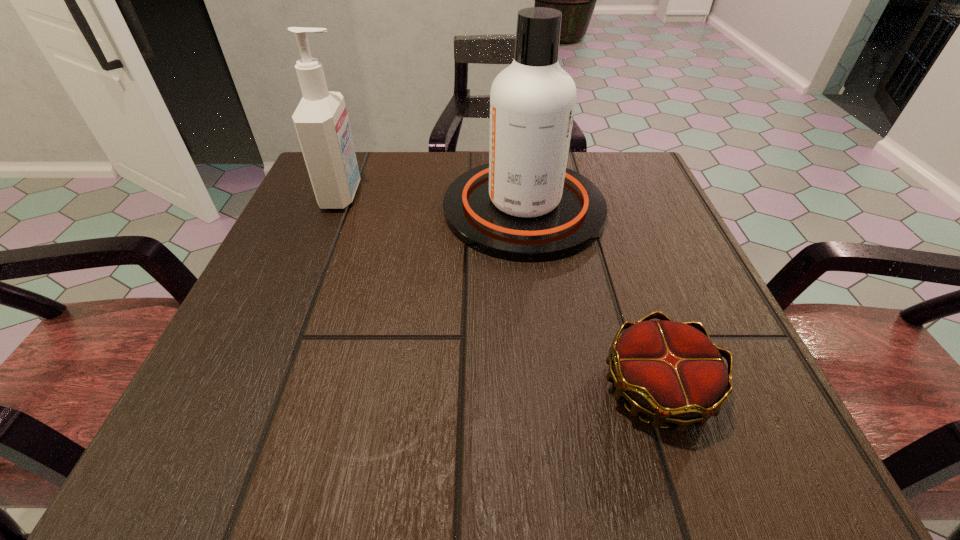
Locate which object is the second closest to the leftmost object. Please provide its 2D coordinates. Your answer should be formatted as a tuple, i.e. [(x, y)], where the tuple contains the x and y coordinates of a point satisfying the conditions above.

[(671, 371)]

I want to click on free space that satisfies the following two spatial constraints: 1. on the front label of the left cleansing agent; 2. on the back side of the right cleansing agent, so click(337, 209).

Identify the location of free spot that satisfies the following two spatial constraints: 1. on the front label of the left cleansing agent; 2. on the right side of the nearest object. The height and width of the screenshot is (540, 960). (265, 389).

Locate an element on the screen. The height and width of the screenshot is (540, 960). free region that satisfies the following two spatial constraints: 1. on the front label of the nearest object; 2. on the left side of the left cleansing agent is located at coordinates (265, 389).

You are a GUI agent. You are given a task and a screenshot of the screen. Output one action in this format:
    pyautogui.click(x=<x>, y=<y>)
    Task: Click on the free location that satisfies the following two spatial constraints: 1. on the front label of the leftmost object; 2. on the back side of the shortest object
    Image resolution: width=960 pixels, height=540 pixels.
    Given the screenshot: What is the action you would take?
    pyautogui.click(x=265, y=389)

Where is `free spot that satisfies the following two spatial constraints: 1. on the front label of the left cleansing agent; 2. on the left side of the right cleansing agent`? free spot that satisfies the following two spatial constraints: 1. on the front label of the left cleansing agent; 2. on the left side of the right cleansing agent is located at coordinates (337, 209).

The height and width of the screenshot is (540, 960). Identify the location of free location that satisfies the following two spatial constraints: 1. on the front label of the left cleansing agent; 2. on the back side of the shortest object. (265, 389).

This screenshot has height=540, width=960. I want to click on vacant space that satisfies the following two spatial constraints: 1. on the front label of the leftmost object; 2. on the right side of the nearest object, so click(265, 389).

Find the location of a particular element. vacant space that satisfies the following two spatial constraints: 1. on the front label of the right cleansing agent; 2. on the right side of the left cleansing agent is located at coordinates (337, 209).

The width and height of the screenshot is (960, 540). In order to click on vacant region that satisfies the following two spatial constraints: 1. on the front label of the left cleansing agent; 2. on the right side of the shortest object in this screenshot , I will do `click(265, 389)`.